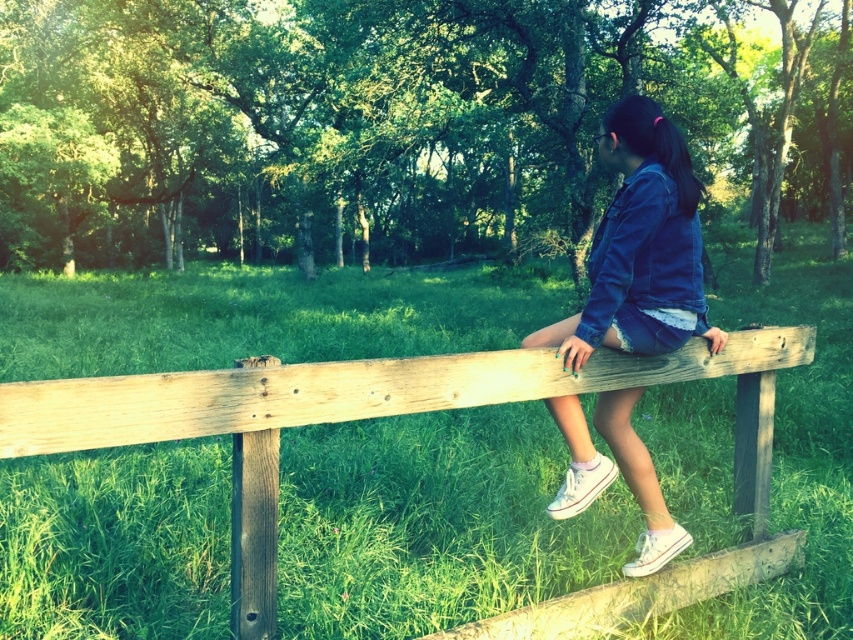
Looking at this image, you are a photographer setting up a shot of the wooden fence at center and the denim jacket at center. Which object should you focus on first if you want to capture both in sharp detail?

The wooden fence at center is bigger than the denim jacket at center, so you should focus on the wooden fence at center first to ensure it is in sharp detail before adjusting for the smaller denim jacket at center.

You are standing at the origin point in the image. The wooden fence at center is located at coordinates point [419,412]. If you walk directly towards the wooden fence at center, which direction should you head?

The wooden fence at center is located at coordinates point [419,412]. Since the coordinate system is not specified, it is impossible to determine the exact direction to head towards the wooden fence at center.